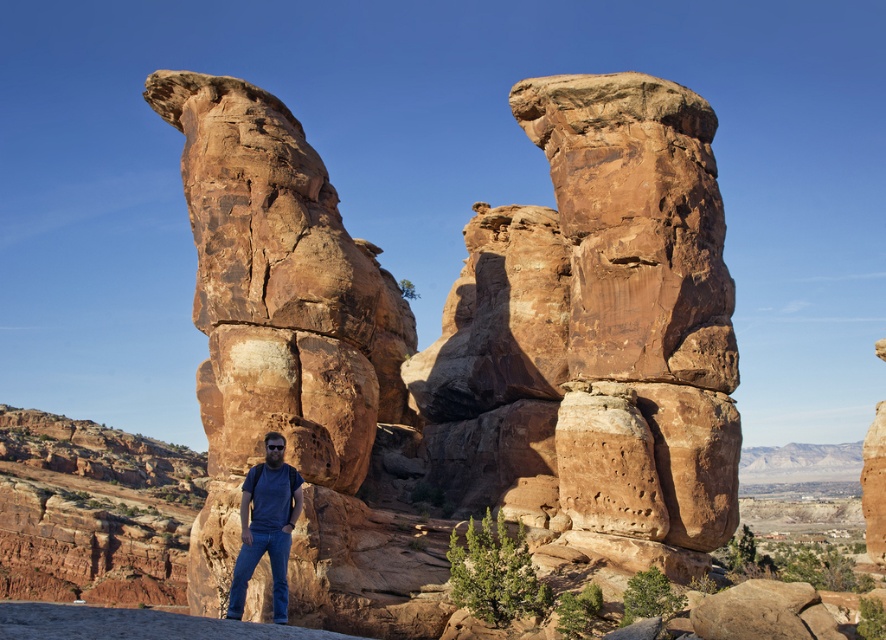
Question: Which object appears closest to the camera in this image?

Choices:
 (A) denim jeans at lower center
 (B) rustic sandstone rock formation at center

Answer: (A)

Question: Is rustic sandstone rock formation at center bigger than denim jeans at lower center?

Choices:
 (A) yes
 (B) no

Answer: (A)

Question: Is rustic sandstone rock formation at center thinner than denim jeans at lower center?

Choices:
 (A) no
 (B) yes

Answer: (A)

Question: Does rustic sandstone rock formation at center have a greater width compared to denim jeans at lower center?

Choices:
 (A) yes
 (B) no

Answer: (A)